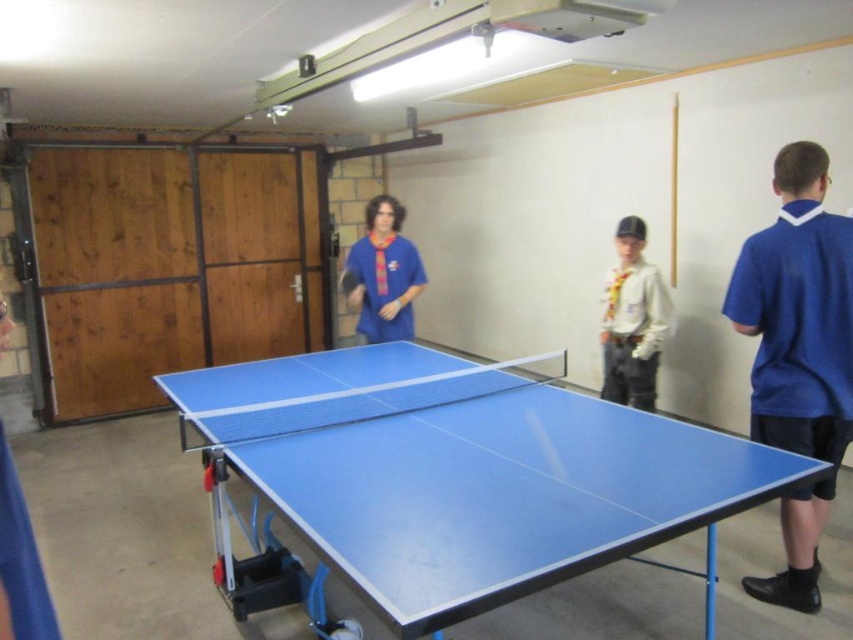
Question: Which point is closer to the camera?

Choices:
 (A) blue rubber table at center
 (B) matte blue shirt at center
 (C) blue fabric shirt at right

Answer: (A)

Question: Where is blue fabric shirt at right located in relation to white cotton shirt at center in the image?

Choices:
 (A) left
 (B) right

Answer: (B)

Question: Estimate the real-world distances between objects in this image. Which object is closer to the blue rubber racket at center?

Choices:
 (A) white cotton shirt at center
 (B) blue fabric shirt at right

Answer: (A)

Question: Is blue rubber table at center to the left of blue rubber racket at center from the viewer's perspective?

Choices:
 (A) no
 (B) yes

Answer: (A)

Question: Which object is positioned closest to the white cotton shirt at center?

Choices:
 (A) matte blue shirt at center
 (B) blue rubber table at center

Answer: (A)

Question: Does blue fabric shirt at right appear on the right side of matte blue shirt at center?

Choices:
 (A) no
 (B) yes

Answer: (B)